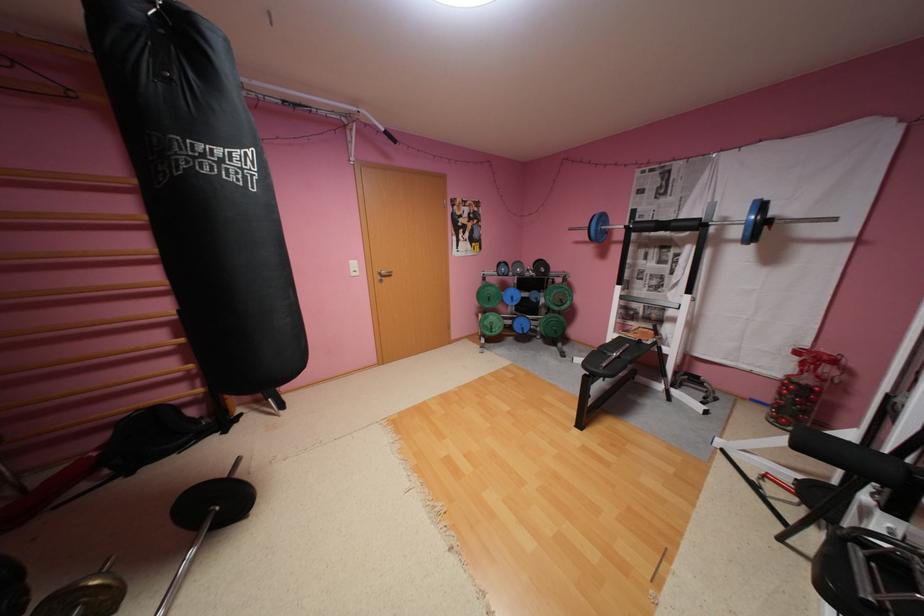
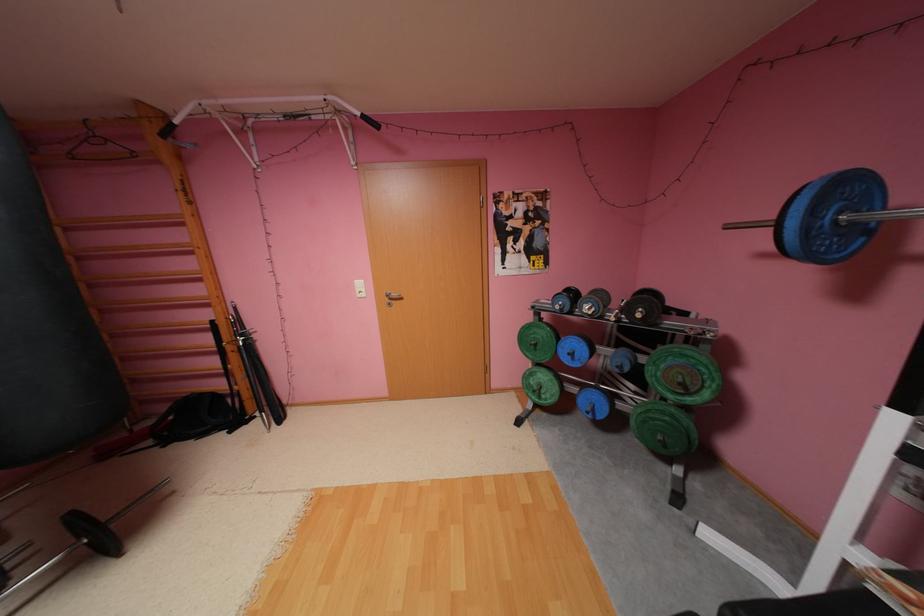
The point at (x=92, y=485) is marked in the first image. Where is the corresponding point in the second image?

(157, 442)